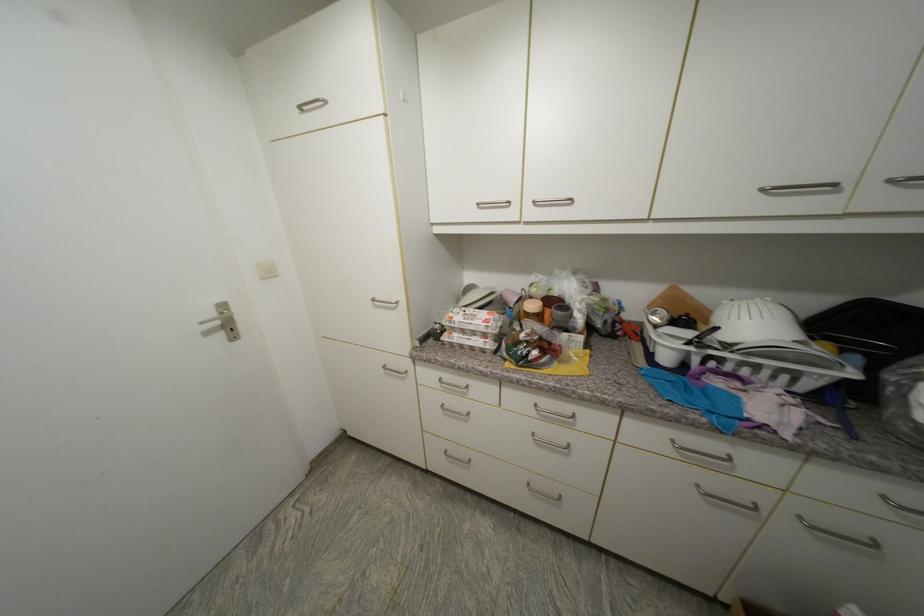
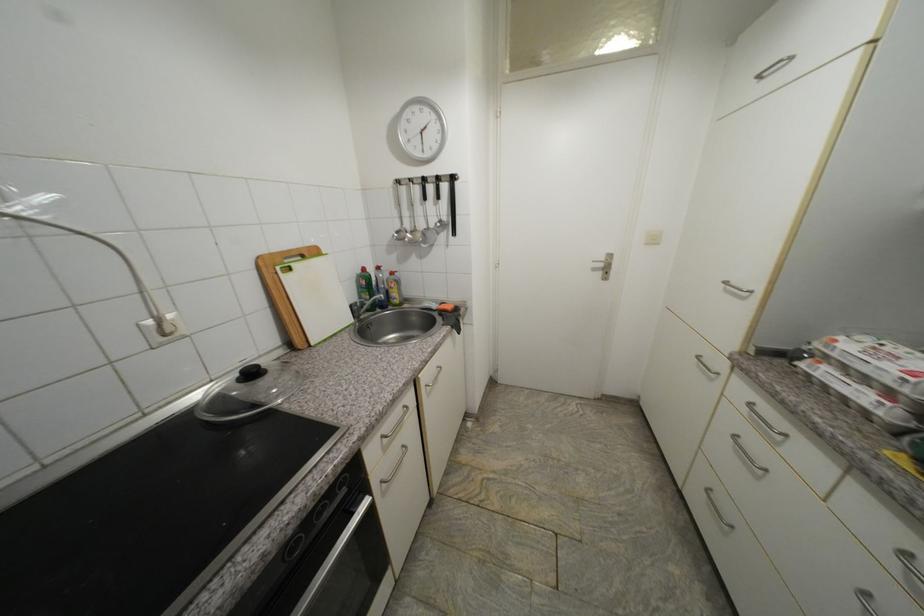
The images are taken continuously from a first-person perspective. In which direction is your viewpoint rotating?

The rotation direction of the camera is left-down.